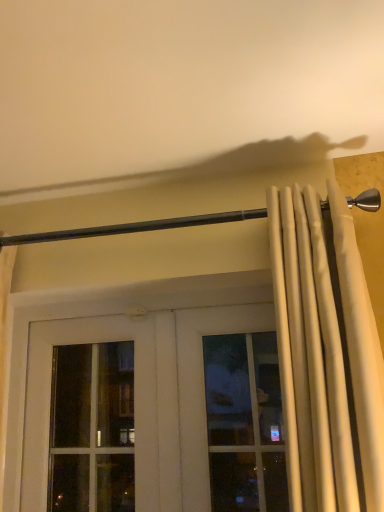
Question: Is point (89, 228) positioned closer to the camera than point (329, 477)?

Choices:
 (A) closer
 (B) farther

Answer: (B)

Question: Considering the positions of black metal rod at upper center and white fabric curtain at right in the image, is black metal rod at upper center taller or shorter than white fabric curtain at right?

Choices:
 (A) short
 (B) tall

Answer: (A)

Question: From the image's perspective, relative to white fabric curtain at right, is black metal rod at upper center above or below?

Choices:
 (A) above
 (B) below

Answer: (A)

Question: Is white fabric curtain at right taller or shorter than black metal rod at upper center?

Choices:
 (A) tall
 (B) short

Answer: (A)

Question: Considering the positions of point (289, 403) and point (208, 220), is point (289, 403) closer or farther from the camera than point (208, 220)?

Choices:
 (A) farther
 (B) closer

Answer: (B)

Question: Is white fabric curtain at right in front of or behind black metal rod at upper center in the image?

Choices:
 (A) front
 (B) behind

Answer: (A)

Question: In terms of size, does white fabric curtain at right appear bigger or smaller than black metal rod at upper center?

Choices:
 (A) big
 (B) small

Answer: (A)